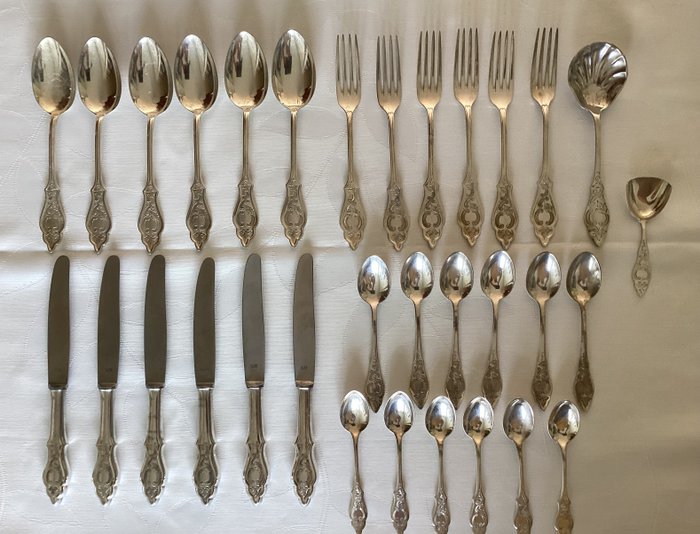
Locate an element on the screen. The image size is (700, 534). butter knife is located at coordinates (57, 318), (106, 324), (153, 325), (211, 333), (252, 337), (299, 339).